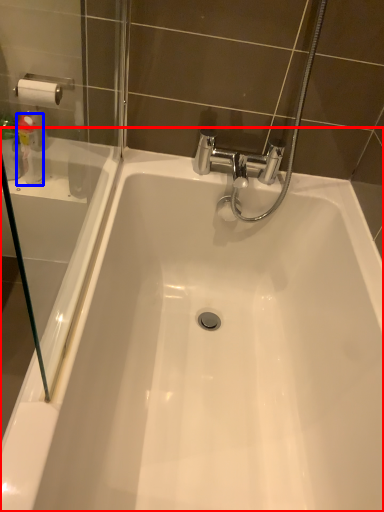
Question: Which point is further to the camera, bathtub (highlighted by a red box) or cleaning product (highlighted by a blue box)?

Choices:
 (A) bathtub
 (B) cleaning product

Answer: (B)